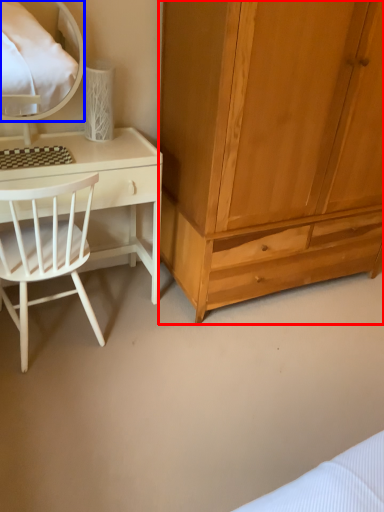
Question: Among these objects, which one is farthest to the camera, cabinetry (highlighted by a red box) or mirror (highlighted by a blue box)?

Choices:
 (A) cabinetry
 (B) mirror

Answer: (B)